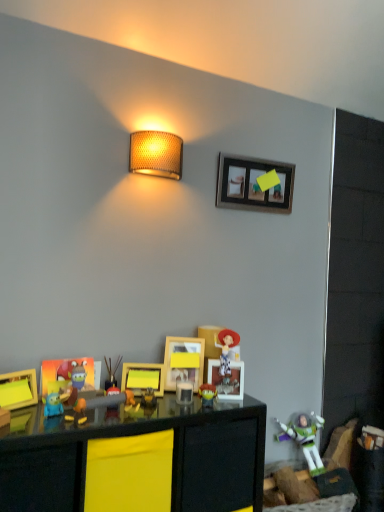
Question: Which direction should I rotate to look at wooden picture frame at upper center, the first picture frame in the right-to-left sequence?

Choices:
 (A) left
 (B) right

Answer: (B)

Question: Is matte yellow picture frame at lower left, which appears as the 5th picture frame when viewed from the right, not inside yellow matte picture frame at center, acting as the 2th picture frame starting from the top?

Choices:
 (A) yes
 (B) no

Answer: (A)

Question: Does matte yellow picture frame at lower left, which ranks as the third picture frame in bottom-to-top order, come behind yellow matte picture frame at center, the 4th picture frame in the bottom-to-top sequence?

Choices:
 (A) no
 (B) yes

Answer: (A)

Question: Is matte yellow picture frame at lower left, which appears as the 5th picture frame when viewed from the right, positioned before yellow matte picture frame at center, the 4th picture frame in the bottom-to-top sequence?

Choices:
 (A) yes
 (B) no

Answer: (A)

Question: Does matte yellow picture frame at lower left, the third picture frame when ordered from top to bottom, have a greater width compared to yellow matte picture frame at center, the fourth picture frame viewed from the left?

Choices:
 (A) no
 (B) yes

Answer: (A)

Question: Is matte yellow picture frame at lower left, the first picture frame from the left, beside yellow matte picture frame at center, the fourth picture frame viewed from the left?

Choices:
 (A) no
 (B) yes

Answer: (A)

Question: Could you tell me if matte yellow picture frame at lower left, the 1th picture frame in the front-to-back sequence, is facing yellow matte picture frame at center, the fourth picture frame viewed from the left?

Choices:
 (A) yes
 (B) no

Answer: (B)

Question: Does black glossy table at lower center have a greater width compared to woven beige lampshade at upper center?

Choices:
 (A) no
 (B) yes

Answer: (B)

Question: Could woven beige lampshade at upper center be considered to be inside black glossy table at lower center?

Choices:
 (A) no
 (B) yes

Answer: (A)

Question: Does black glossy table at lower center have a greater height compared to woven beige lampshade at upper center?

Choices:
 (A) yes
 (B) no

Answer: (A)

Question: Considering the relative sizes of black glossy table at lower center and woven beige lampshade at upper center in the image provided, is black glossy table at lower center smaller than woven beige lampshade at upper center?

Choices:
 (A) no
 (B) yes

Answer: (A)

Question: Is black glossy table at lower center oriented towards woven beige lampshade at upper center?

Choices:
 (A) no
 (B) yes

Answer: (A)

Question: Is black glossy table at lower center not near woven beige lampshade at upper center?

Choices:
 (A) no
 (B) yes

Answer: (B)

Question: Can you see matte plastic toy at center, marked as the 4th toy in a bottom-to-top arrangement, touching matte blue toy at lower left, which ranks as the 1th toy in left-to-right order?

Choices:
 (A) yes
 (B) no

Answer: (B)